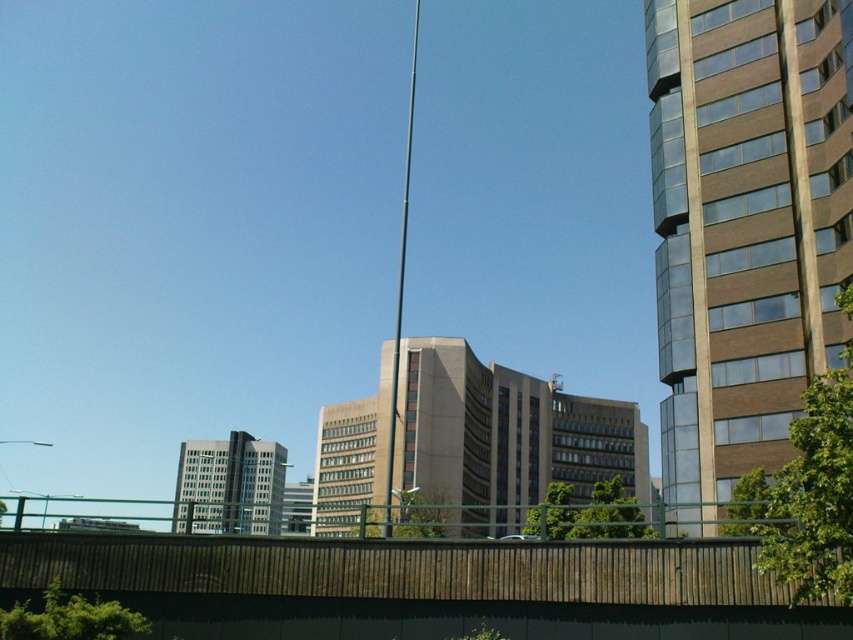
Can you confirm if brown concrete building at right is bigger than brown wooden fence at lower center?

Correct, brown concrete building at right is larger in size than brown wooden fence at lower center.

Can you confirm if brown concrete building at right is thinner than brown wooden fence at lower center?

In fact, brown concrete building at right might be wider than brown wooden fence at lower center.

The width and height of the screenshot is (853, 640). I want to click on brown concrete building at right, so click(x=744, y=227).

Is point (503, 435) closer to camera compared to point (410, 124)?

Yes.

Measure the distance between beige concrete building at center and camera.

12.47 meters

Identify the location of beige concrete building at center. The height and width of the screenshot is (640, 853). (503, 436).

Can you confirm if beige concrete building at center is wider than gray concrete building at lower left?

No.

Where is `beige concrete building at center`? The image size is (853, 640). beige concrete building at center is located at coordinates [503, 436].

Describe the element at coordinates (503, 436) in the screenshot. This screenshot has width=853, height=640. I see `beige concrete building at center` at that location.

Where is `beige concrete building at center`? This screenshot has width=853, height=640. beige concrete building at center is located at coordinates (503, 436).